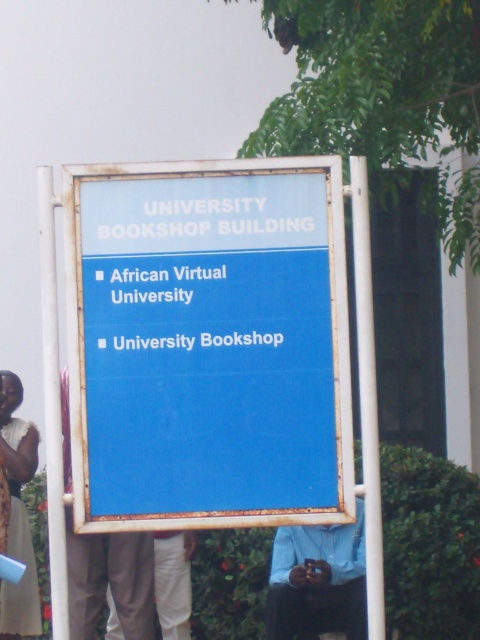
You are a photographer trying to capture a person wearing a blue shirt at center and light brown pants at lower left. Based on the scene, which clothing item will appear larger in your photo?

The blue shirt at center appears larger in the photo because it is much taller than the light brown pants at lower left.

In the scene described, there is a blue shirt at center and a white lace dress at lower left. From the perspective of an observer standing in front of the signboard, which clothing item is positioned to the right of the other?

The blue shirt at center is to the right of the white lace dress at lower left.